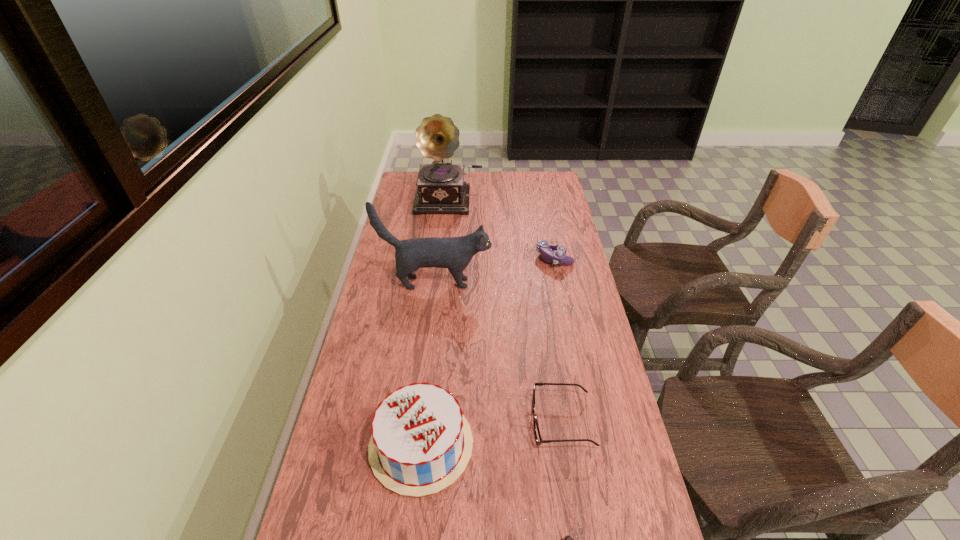
Find the location of a particular element. vacant position in the image that satisfies the following two spatial constraints: 1. at the face of the second tallest object; 2. on the left side of the birthday cake is located at coordinates (417, 445).

This screenshot has height=540, width=960. I want to click on free space that satisfies the following two spatial constraints: 1. at the face of the birthday cake; 2. on the right side of the second tallest object, so click(x=417, y=445).

At what (x,y) coordinates should I click in order to perform the action: click on free space that satisfies the following two spatial constraints: 1. at the face of the fourth shortest object; 2. on the right side of the cat. Please return your answer as a coordinate pair (x, y). Looking at the image, I should click on (417, 445).